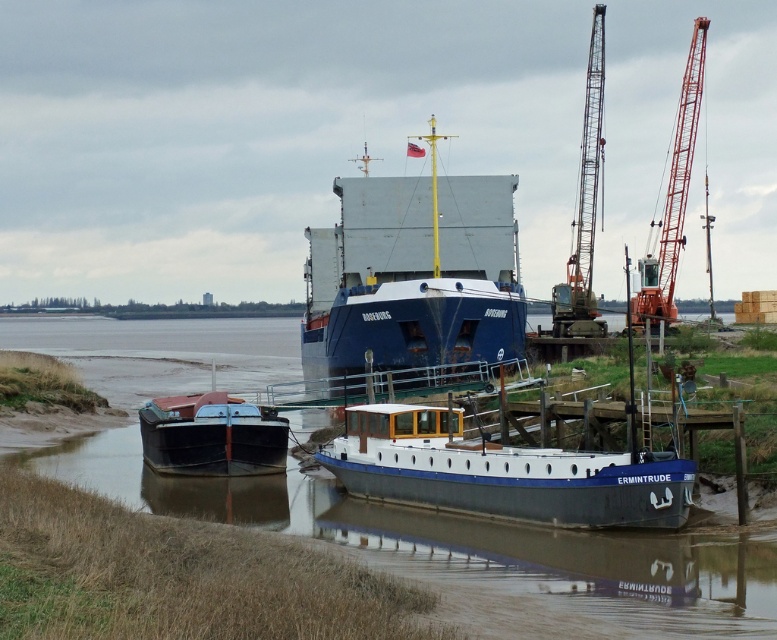
Is matte black boat at lower left taller than metallic gray crane at upper right?

Incorrect, matte black boat at lower left's height is not larger of metallic gray crane at upper right's.

Looking at this image, can you confirm if matte black boat at lower left is bigger than metallic gray crane at upper right?

Incorrect, matte black boat at lower left is not larger than metallic gray crane at upper right.

Is point (176, 456) behind point (594, 72)?

No, (176, 456) is closer to viewer.

At what (x,y) coordinates should I click in order to perform the action: click on matte black boat at lower left. Please return your answer as a coordinate pair (x, y). The height and width of the screenshot is (640, 777). Looking at the image, I should click on (211, 435).

Who is positioned more to the right, smooth mud at boat center or blue matte cargo ship at center?

From the viewer's perspective, blue matte cargo ship at center appears more on the right side.

Is point (701, 636) farther from camera compared to point (434, 243)?

No.

Which is behind, point (531, 616) or point (420, 243)?

Point (420, 243)

You are a GUI agent. You are given a task and a screenshot of the screen. Output one action in this format:
    pyautogui.click(x=<x>, y=<y>)
    Task: Click on the smooth mud at boat center
    This screenshot has width=777, height=640.
    Given the screenshot: What is the action you would take?
    pyautogui.click(x=467, y=550)

The image size is (777, 640). I want to click on blue matte cargo ship at center, so click(413, 275).

Is blue matte cargo ship at center bigger than white glossy boat at center?

Yes.

Measure the distance between blue matte cargo ship at center and camera.

blue matte cargo ship at center is 146.64 feet from camera.

Identify the location of blue matte cargo ship at center. The height and width of the screenshot is (640, 777). (413, 275).